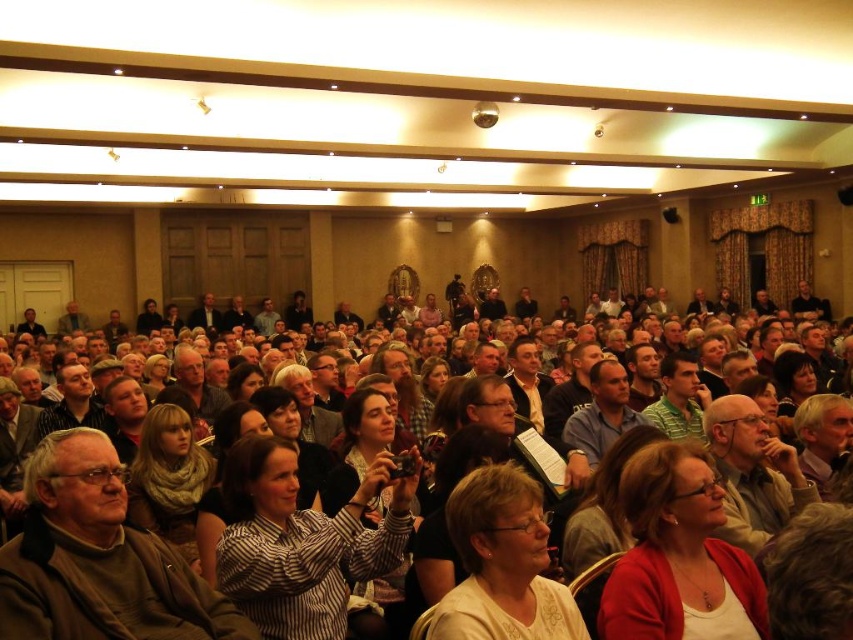
Question: Which is farther from the matte blue shirt at center?

Choices:
 (A) striped fabric camera at center
 (B) green striped shirt at center

Answer: (A)

Question: Does matte red cardigan at center come in front of matte blue shirt at center?

Choices:
 (A) no
 (B) yes

Answer: (B)

Question: Can you confirm if matte blue shirt at center is bigger than green striped shirt at center?

Choices:
 (A) no
 (B) yes

Answer: (B)

Question: Which point is closer to the camera?

Choices:
 (A) (601, 422)
 (B) (280, 488)
 (C) (669, 422)

Answer: (B)

Question: Is matte blue shirt at center to the right of green striped shirt at center from the viewer's perspective?

Choices:
 (A) yes
 (B) no

Answer: (B)

Question: Among these points, which one is nearest to the camera?

Choices:
 (A) (608, 429)
 (B) (512, 516)
 (C) (4, 554)
 (D) (688, 560)

Answer: (C)